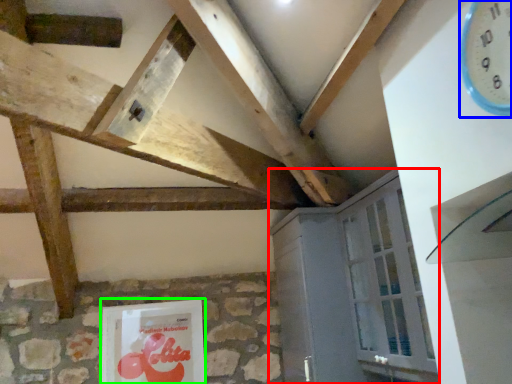
Question: Considering the real-world distances, which object is farthest from cabinetry (highlighted by a red box)? clock (highlighted by a blue box) or picture frame (highlighted by a green box)?

Choices:
 (A) clock
 (B) picture frame

Answer: (A)